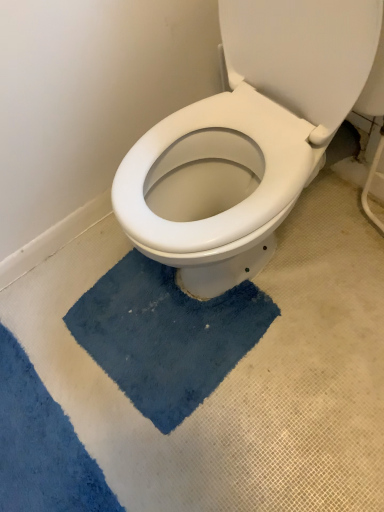
Where is `free spot below blue plush bath mat at center, which is the second bath mat in left-to-right order (from a real-world perspective)`? This screenshot has width=384, height=512. free spot below blue plush bath mat at center, which is the second bath mat in left-to-right order (from a real-world perspective) is located at coordinates (144, 343).